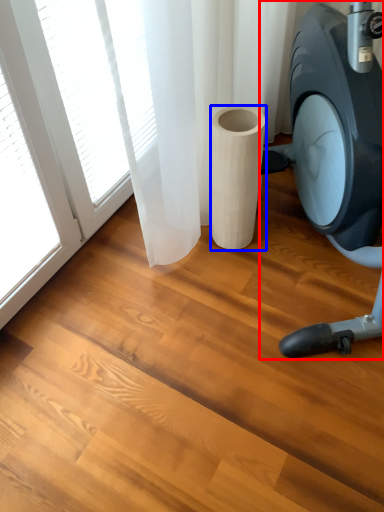
Question: Which point is closer to the camera, stationary bicycle (highlighted by a red box) or paper towel (highlighted by a blue box)?

Choices:
 (A) stationary bicycle
 (B) paper towel

Answer: (A)